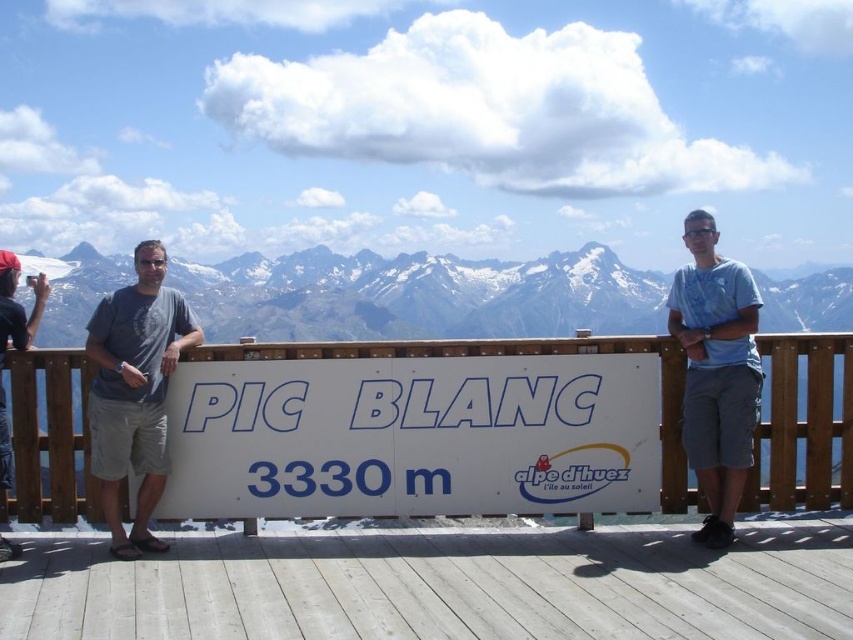
Question: Is white plastic sign at center to the left of white snow-covered mountains at upper center from the viewer's perspective?

Choices:
 (A) no
 (B) yes

Answer: (A)

Question: Which point is closer to the camera?

Choices:
 (A) (746, 435)
 (B) (653, 468)
 (C) (33, 323)
 (D) (189, 326)

Answer: (A)

Question: Considering the real-world distances, which object is closest to the blue cotton shirt at center?

Choices:
 (A) white wooden deck at center
 (B) white snow-covered mountains at upper center
 (C) white plastic sign at center
 (D) gray cotton t-shirt at left

Answer: (C)

Question: Can you confirm if white wooden deck at center is positioned above white snow-covered mountains at upper center?

Choices:
 (A) no
 (B) yes

Answer: (A)

Question: In this image, where is gray cotton t-shirt at left located relative to blue cotton shirt at center?

Choices:
 (A) below
 (B) above

Answer: (A)

Question: Which of the following is the farthest from the observer?

Choices:
 (A) dark blue t-shirt at left
 (B) blue cotton shirt at center
 (C) white plastic sign at center

Answer: (C)